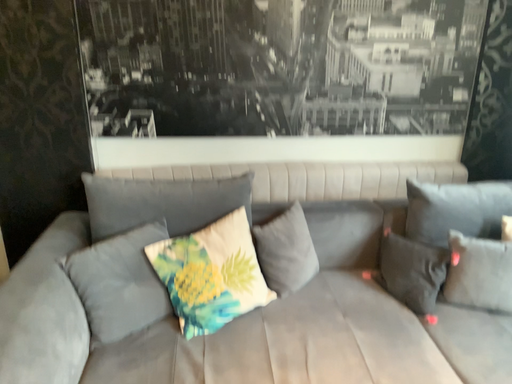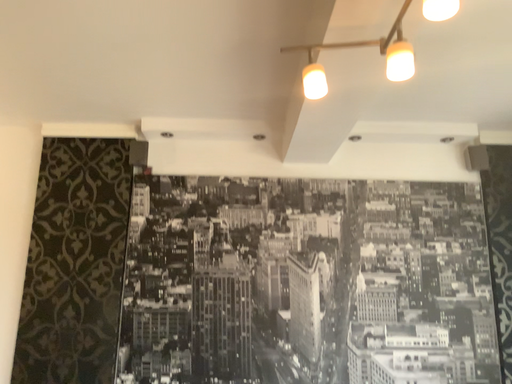
Question: How did the camera likely rotate when shooting the video?

Choices:
 (A) rotated upward
 (B) rotated downward

Answer: (A)